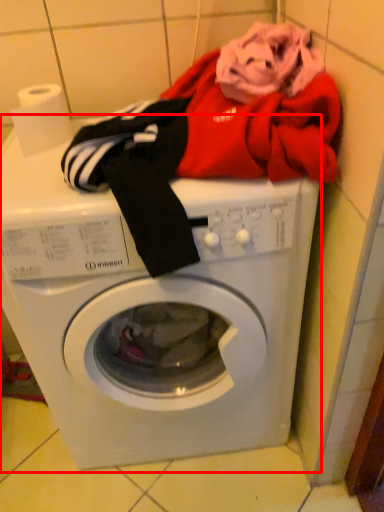
Question: From the image's perspective, where is washing machine (annotated by the red box) located relative to toilet paper?

Choices:
 (A) above
 (B) below

Answer: (B)